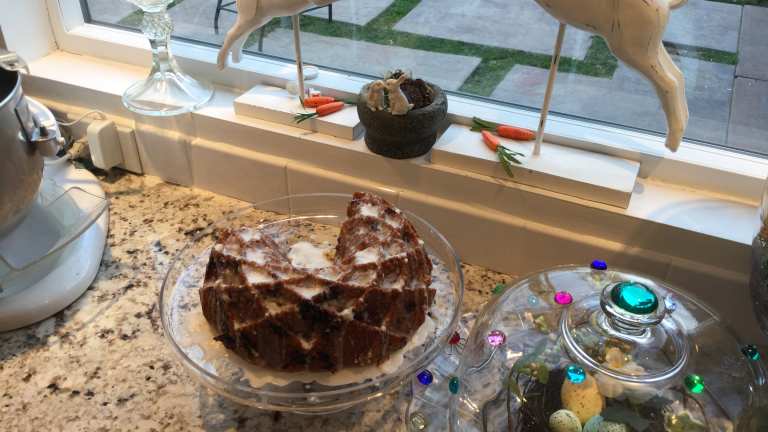
I want to click on window sill, so 91,77, 720,220.